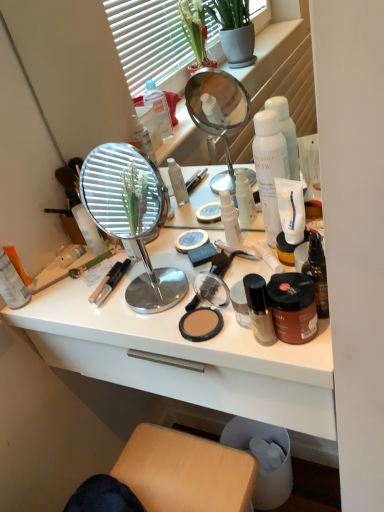
Question: Are matte black compact at center and white matte tube at center-right, which is the 2th product in top-to-bottom order, far apart?

Choices:
 (A) yes
 (B) no

Answer: (B)

Question: Is matte black compact at center aimed at white matte tube at center-right, which is the 2th product in top-to-bottom order?

Choices:
 (A) no
 (B) yes

Answer: (A)

Question: From a real-world perspective, does matte black compact at center sit lower than white matte tube at center-right, placed as the first product when sorted from bottom to top?

Choices:
 (A) no
 (B) yes

Answer: (B)

Question: From a real-world perspective, is matte black compact at center physically above white matte tube at center-right, placed as the first product when sorted from bottom to top?

Choices:
 (A) no
 (B) yes

Answer: (A)

Question: Is matte black compact at center closer to the viewer compared to white matte tube at center-right, placed as the first product when sorted from bottom to top?

Choices:
 (A) yes
 (B) no

Answer: (A)

Question: From the image's perspective, is matte black compact at center above white matte tube at center-right, placed as the first product when sorted from bottom to top?

Choices:
 (A) yes
 (B) no

Answer: (B)

Question: Considering the relative sizes of white matte tube at center-right, placed as the first product when sorted from bottom to top, and matte black brush at lower left in the image provided, is white matte tube at center-right, placed as the first product when sorted from bottom to top, shorter than matte black brush at lower left?

Choices:
 (A) no
 (B) yes

Answer: (A)

Question: From the image's perspective, does white matte tube at center-right, placed as the first product when sorted from bottom to top, appear lower than matte black brush at lower left?

Choices:
 (A) no
 (B) yes

Answer: (A)

Question: Is white matte tube at center-right, which is the 2th product in top-to-bottom order, not inside matte black brush at lower left?

Choices:
 (A) yes
 (B) no

Answer: (A)

Question: Can you confirm if white matte tube at center-right, placed as the first product when sorted from bottom to top, is wider than matte black brush at lower left?

Choices:
 (A) no
 (B) yes

Answer: (A)

Question: Can you confirm if white matte tube at center-right, placed as the first product when sorted from bottom to top, is bigger than matte black brush at lower left?

Choices:
 (A) no
 (B) yes

Answer: (B)

Question: Is white matte tube at center-right, placed as the first product when sorted from bottom to top, at the left side of matte black brush at lower left?

Choices:
 (A) no
 (B) yes

Answer: (A)

Question: From the image's perspective, does orange matte lotion at left, the 5th toiletry positioned from the right, appear lower than silver/metallic mirror at center?

Choices:
 (A) no
 (B) yes

Answer: (B)